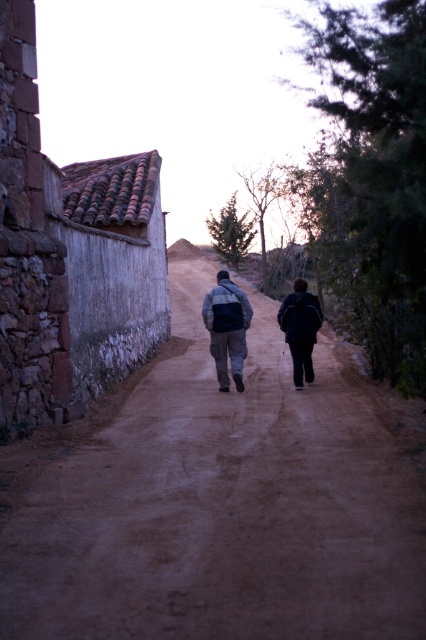
Question: Does rusty corrugated metal roof at left appear under dark blue backpack at center?

Choices:
 (A) yes
 (B) no

Answer: (B)

Question: Which point is farther from the camera taking this photo?

Choices:
 (A) (238, 324)
 (B) (233, 285)
 (C) (54, 392)

Answer: (B)

Question: Which point is farther to the camera?

Choices:
 (A) dark blue backpack at center
 (B) dusty dirt road at center

Answer: (A)

Question: Can you confirm if rusty corrugated metal roof at left is positioned below matte gray jacket at center?

Choices:
 (A) yes
 (B) no

Answer: (B)

Question: Among these points, which one is farthest from the camera?

Choices:
 (A) (75, 225)
 (B) (279, 566)

Answer: (A)

Question: Can you confirm if dark blue backpack at center is positioned above matte gray jacket at center?

Choices:
 (A) no
 (B) yes

Answer: (B)